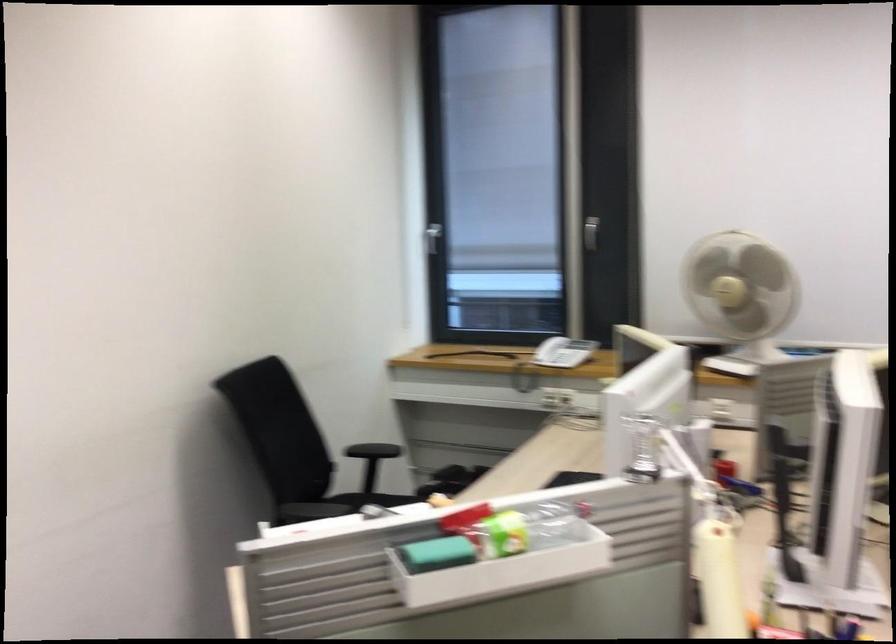
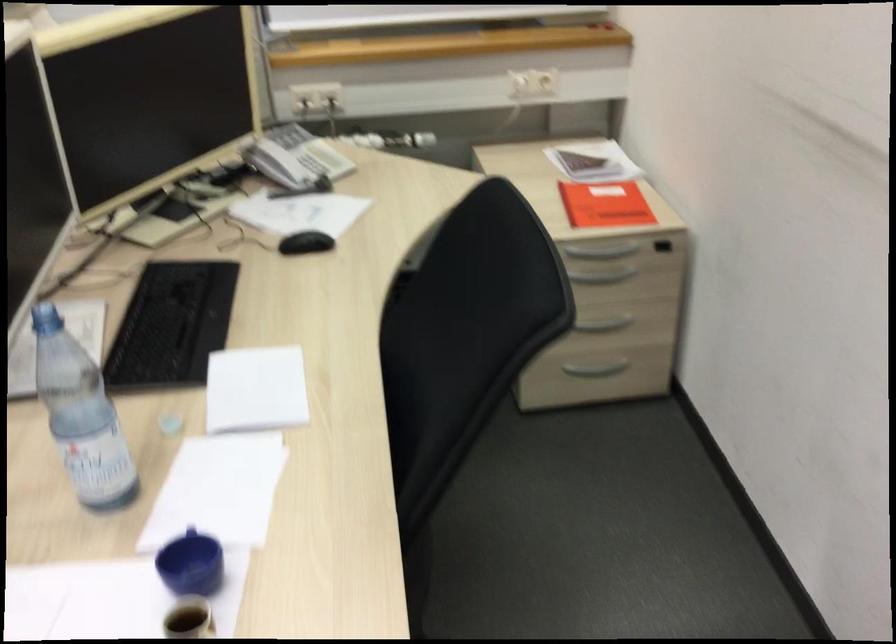
How did the camera likely rotate?

The camera rotated toward right-down.